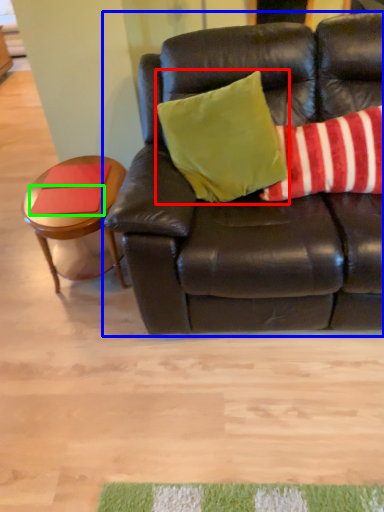
Question: Which object is positioned closest to pillow (highlighted by a red box)? Select from studio couch (highlighted by a blue box) and pad (highlighted by a green box).

Choices:
 (A) studio couch
 (B) pad

Answer: (A)